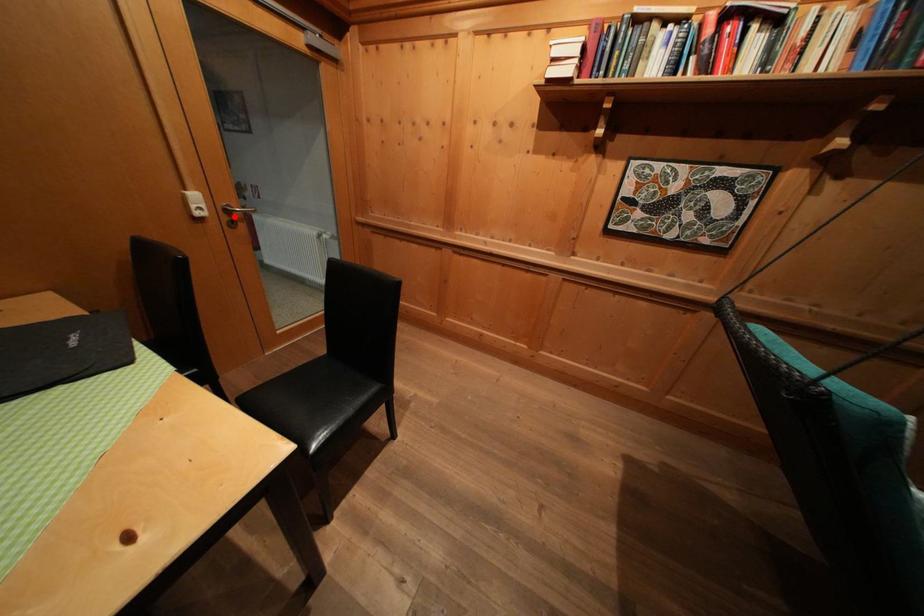
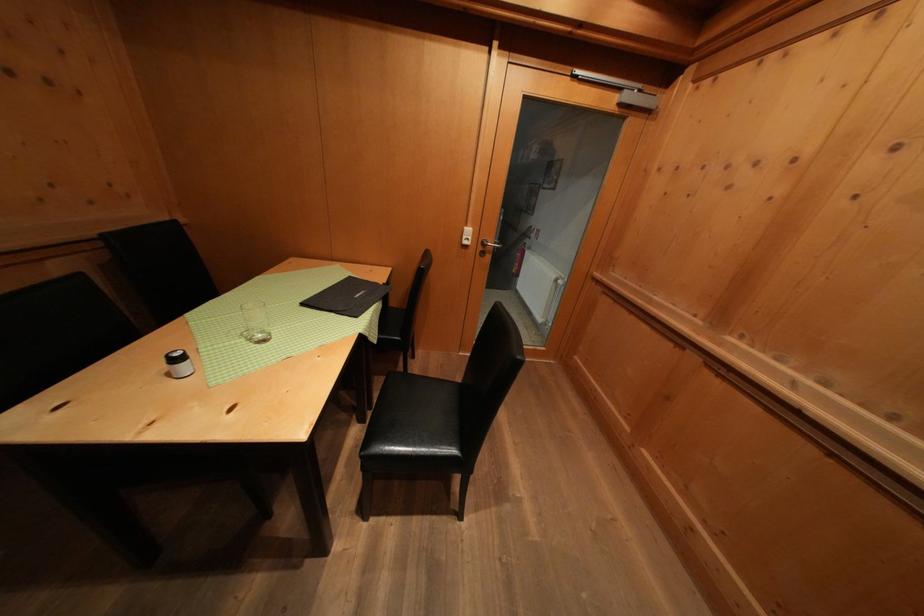
Find the pixel in the second image that matches the highlighted location in the first image.

(490, 249)